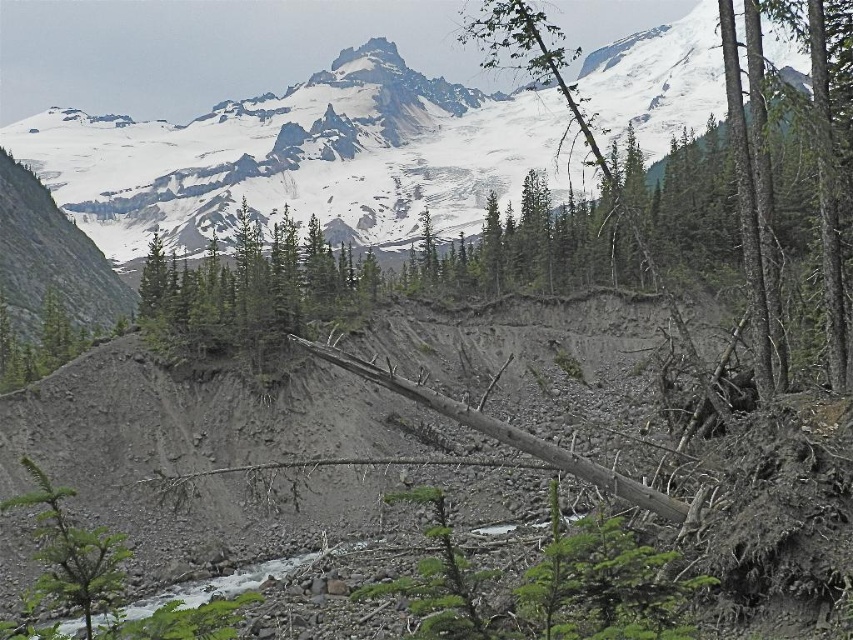
Can you confirm if snowy granite mountain at upper center is bigger than green leafy tree at upper center?

Indeed, snowy granite mountain at upper center has a larger size compared to green leafy tree at upper center.

Is the position of snowy granite mountain at upper center less distant than that of green leafy tree at upper center?

Yes, snowy granite mountain at upper center is in front of green leafy tree at upper center.

This screenshot has width=853, height=640. Describe the element at coordinates (299, 161) in the screenshot. I see `snowy granite mountain at upper center` at that location.

This screenshot has width=853, height=640. In order to click on snowy granite mountain at upper center in this screenshot , I will do `click(299, 161)`.

Is green matte tree at center further to camera compared to green leafy tree at upper center?

That is True.

Is point (157, 260) positioned before point (529, 56)?

Yes.

Is point (363, 268) positioned before point (602, 156)?

Yes, it is.

In order to click on green matte tree at center in this screenshot , I will do `click(251, 292)`.

Can you confirm if snowy granite mountain at upper center is smaller than green matte tree at center?

No.

Which is behind, point (534, 154) or point (279, 225)?

The point (534, 154) is behind.

Between point (613, 136) and point (206, 328), which one is positioned behind?

Positioned behind is point (613, 136).

The image size is (853, 640). I want to click on snowy granite mountain at upper center, so click(299, 161).